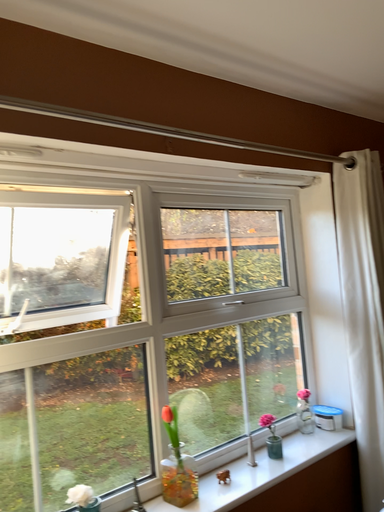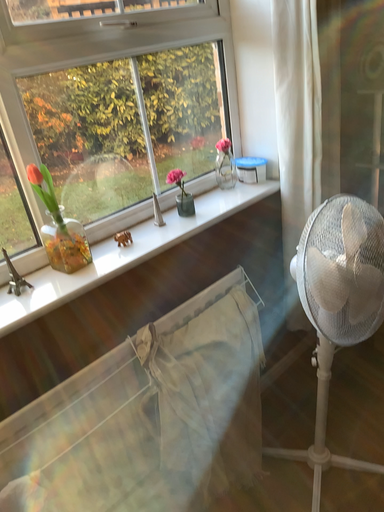
Question: Which way did the camera rotate in the video?

Choices:
 (A) rotated upward
 (B) rotated downward

Answer: (B)